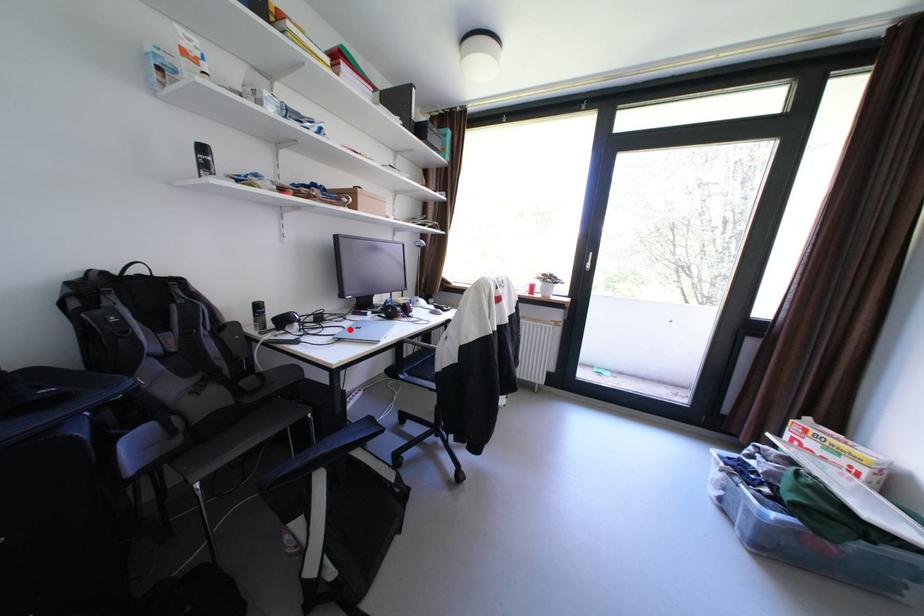
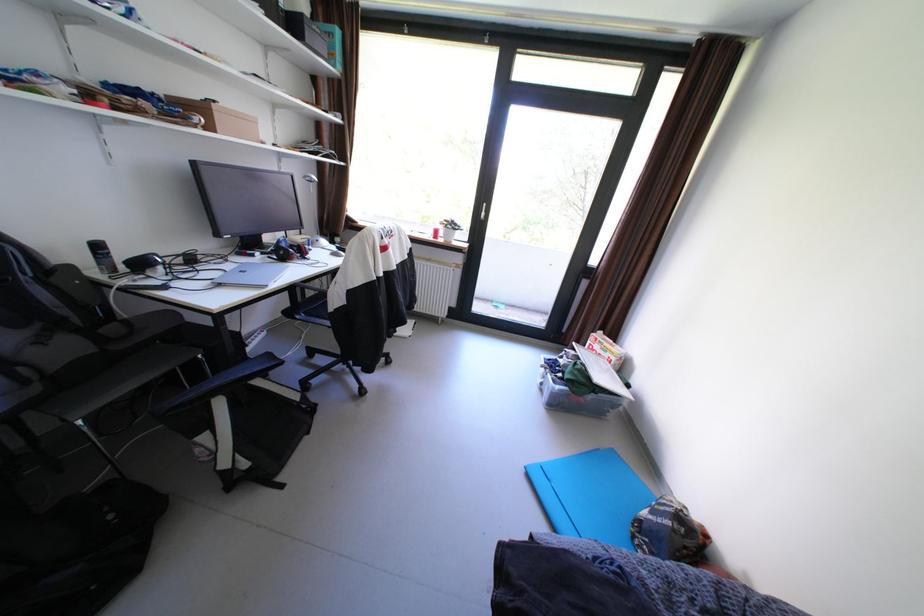
The point at the highlighted location is marked in the first image. Where is the corresponding point in the second image?

(229, 273)